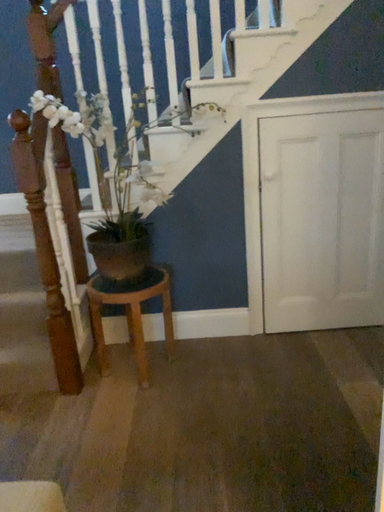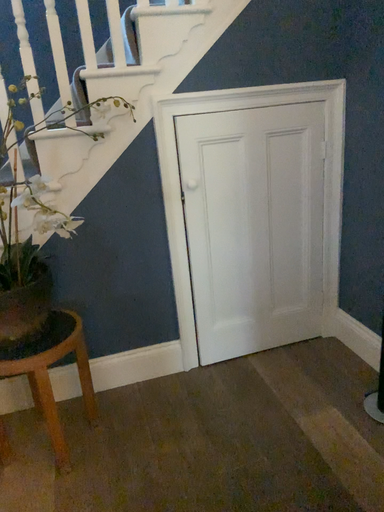
Question: How did the camera likely rotate when shooting the video?

Choices:
 (A) rotated right
 (B) rotated left

Answer: (A)